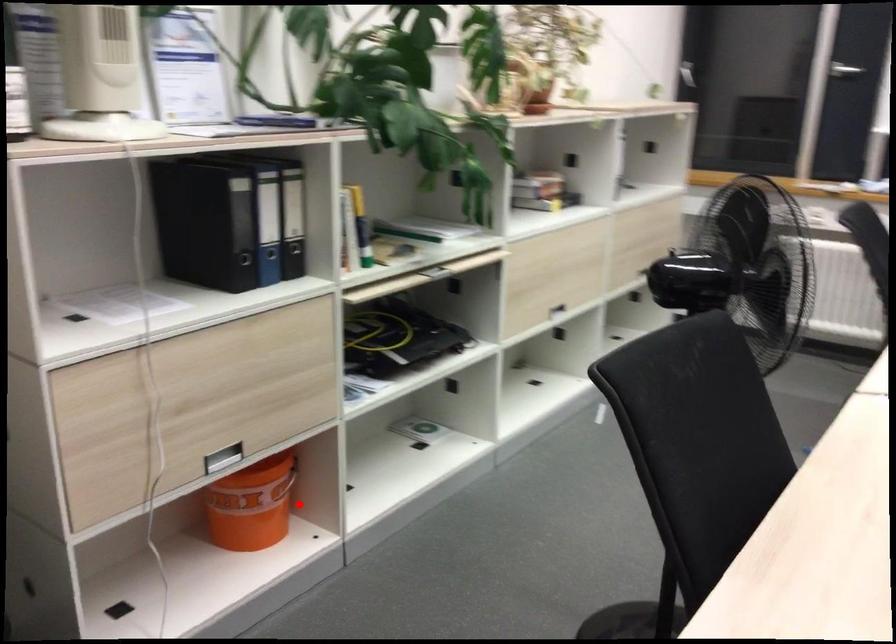
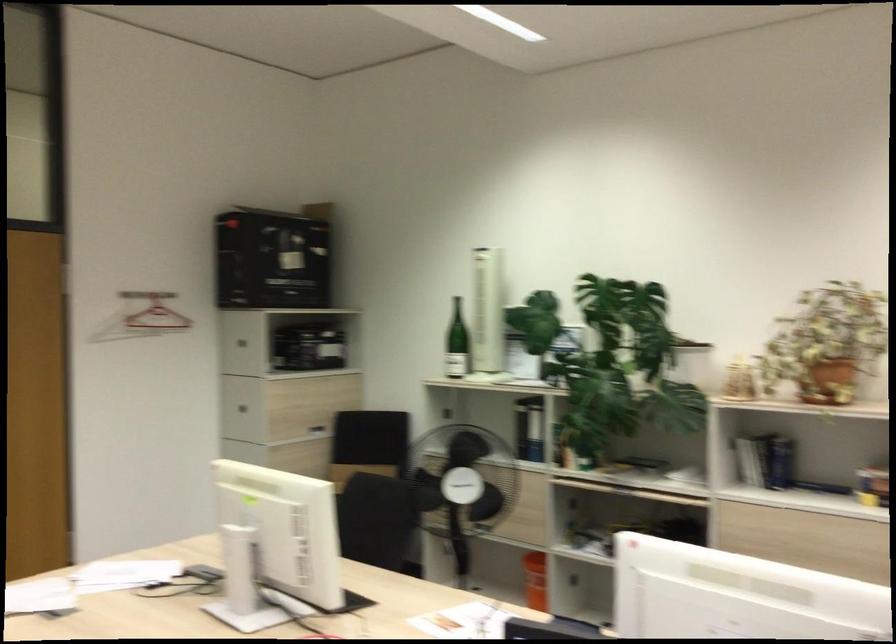
Question: I am providing you with two images of the same scene from different viewpoints. A red point is shown in image1. For the corresponding object point in image2, is it positioned nearer or farther from the camera?

Choices:
 (A) Nearer
 (B) Farther

Answer: (B)